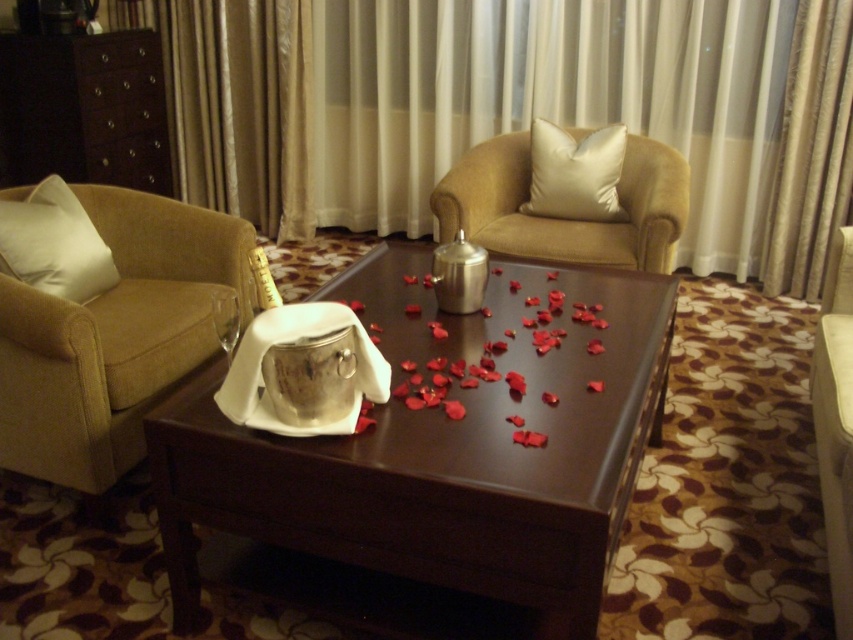
You are standing in the living room corner and want to place a decorative vase on the coffee table. The white soft pillow at left is currently occupying space on the table. Is there enough room to place the vase without moving the pillow?

The white soft pillow at left is located at point (54, 244) on the table. Since the pillow is only occupying a small portion of the table, there should be enough space to place the vase elsewhere on the table without moving the pillow.

You are standing in the living room and want to place a decorative vase on the coffee table. The vase is 15 cm tall. The point representing the satin beige armchair at center is at coordinate (566, 218). Can you determine if the vase will fit on the coffee table without obstructing the armchair?

The point representing the satin beige armchair at center is at coordinate (566, 218). Since the vase is placed on the coffee table, which is separate from the armchair, the vase will not obstruct the armchair as they are distinct objects in the scene.

You are a guest entering the living room and see the matte beige armchair at left and the satin beige armchair at center. Which chair is positioned to the right side of the other?

The satin beige armchair at center is positioned to the right of the matte beige armchair at left.